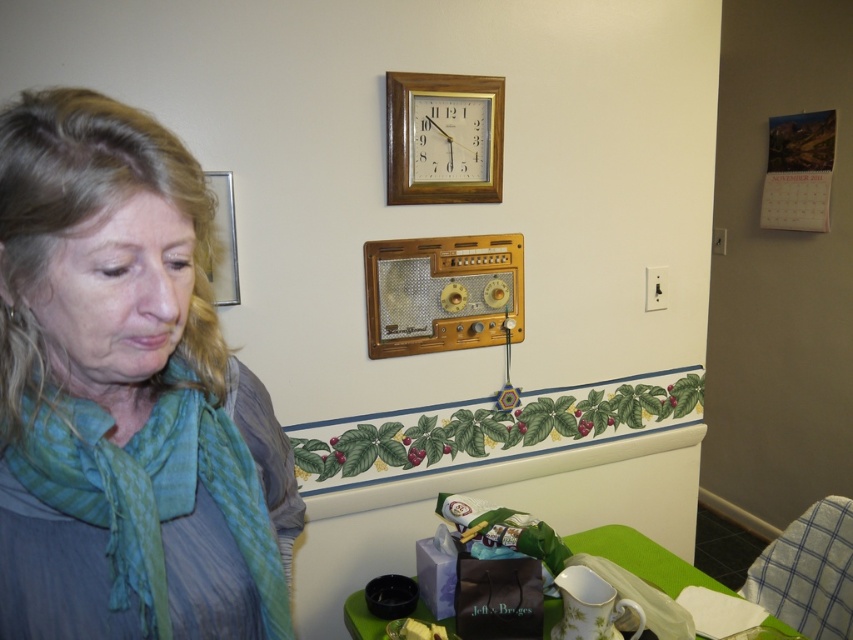
You are standing in the dining area and see two points marked on the wall. The first point is at coordinate point (401, 100) and the second is at point (218, 244). Which point is closer to the framed clock mounted on the wall?

Point (401, 100) is behind point (218, 244), so the point closer to the framed clock is point (218, 244).

Looking at this image, you are a delivery person who needs to place a matte purple paper bag at lower center in the dining area. The coordinates provided are point (643, 557). Can you confirm if this point is correctly located at the lower center of the room?

Yes, the coordinates point (643, 557) correspond to the matte purple paper bag at lower center, confirming its correct placement at the lower center of the room.